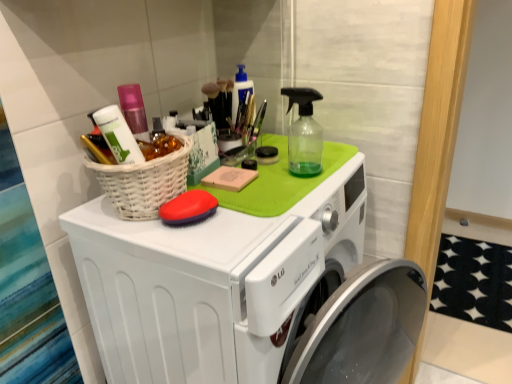
Question: Can you confirm if white wicker basket at upper left is bigger than white plastic washing machine at upper center?

Choices:
 (A) yes
 (B) no

Answer: (B)

Question: Is white wicker basket at upper left aimed at white plastic washing machine at upper center?

Choices:
 (A) no
 (B) yes

Answer: (A)

Question: From the image's perspective, is white wicker basket at upper left under white plastic washing machine at upper center?

Choices:
 (A) no
 (B) yes

Answer: (A)

Question: From a real-world perspective, is white wicker basket at upper left physically above white plastic washing machine at upper center?

Choices:
 (A) yes
 (B) no

Answer: (A)

Question: Is white plastic washing machine at upper center at the back of white wicker basket at upper left?

Choices:
 (A) no
 (B) yes

Answer: (A)

Question: Relative to white wicker basket at upper left, is white plastic washing machine at upper center in front or behind?

Choices:
 (A) behind
 (B) front

Answer: (B)

Question: Looking at their shapes, would you say white plastic washing machine at upper center is wider or thinner than white wicker basket at upper left?

Choices:
 (A) thin
 (B) wide

Answer: (B)

Question: From the image's perspective, relative to white wicker basket at upper left, is white plastic washing machine at upper center above or below?

Choices:
 (A) below
 (B) above

Answer: (A)

Question: From a real-world perspective, relative to white wicker basket at upper left, is white plastic washing machine at upper center vertically above or below?

Choices:
 (A) above
 (B) below

Answer: (B)

Question: Is white wicker basket at upper left taller or shorter than red rubber brush at center?

Choices:
 (A) tall
 (B) short

Answer: (A)

Question: From the image's perspective, relative to red rubber brush at center, is white wicker basket at upper left above or below?

Choices:
 (A) above
 (B) below

Answer: (A)

Question: Is white wicker basket at upper left spatially inside red rubber brush at center, or outside of it?

Choices:
 (A) outside
 (B) inside

Answer: (A)

Question: Is white wicker basket at upper left wider or thinner than red rubber brush at center?

Choices:
 (A) thin
 (B) wide

Answer: (B)

Question: Is red rubber brush at center wider or thinner than white plastic washing machine at upper center?

Choices:
 (A) thin
 (B) wide

Answer: (A)

Question: Which is correct: red rubber brush at center is inside white plastic washing machine at upper center, or outside of it?

Choices:
 (A) outside
 (B) inside

Answer: (B)